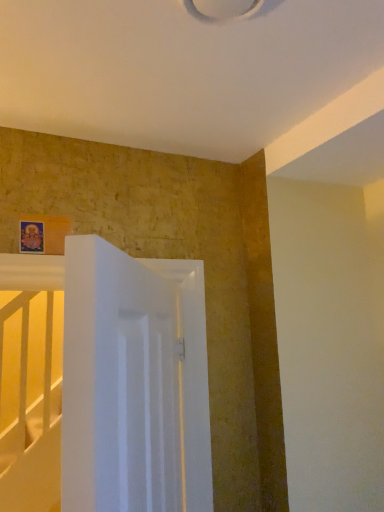
Where is `white glossy door at center`? This screenshot has height=512, width=384. white glossy door at center is located at coordinates (134, 382).

Image resolution: width=384 pixels, height=512 pixels. What do you see at coordinates (134, 382) in the screenshot?
I see `white glossy door at center` at bounding box center [134, 382].

What is the approximate width of white glossy door at center?

The width of white glossy door at center is 2.07 inches.

Locate an element on the screen. The height and width of the screenshot is (512, 384). white glossy door at center is located at coordinates (134, 382).